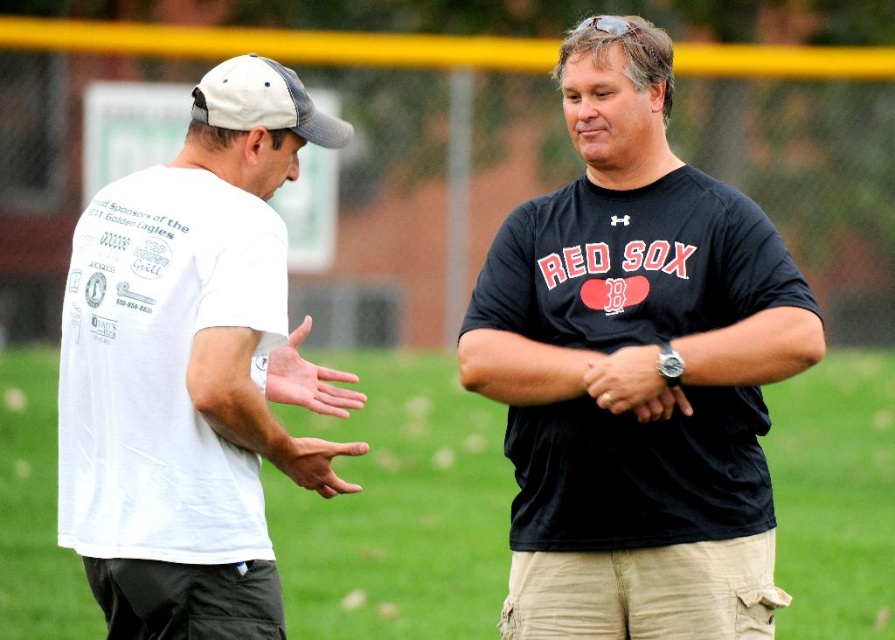
What do you see at coordinates (658, 365) in the screenshot? I see `black matte t-shirt at center` at bounding box center [658, 365].

Locate an element on the screen. Image resolution: width=895 pixels, height=640 pixels. black matte t-shirt at center is located at coordinates (658, 365).

Between white mesh baseball cap at upper left and matte white hand at center, which one is positioned lower?

Positioned lower is matte white hand at center.

Which is behind, point (284, 76) or point (305, 317)?

Positioned behind is point (305, 317).

Between point (297, 83) and point (312, 385), which one is positioned in front?

Point (297, 83) is more forward.

Locate an element on the screen. white mesh baseball cap at upper left is located at coordinates (263, 100).

How distant is white cotton t-shirt at left from white matte shirt at left?

white cotton t-shirt at left is 4.63 meters away from white matte shirt at left.

Looking at this image, can you confirm if white cotton t-shirt at left is positioned below white matte shirt at left?

No.

Where is `white cotton t-shirt at left`? white cotton t-shirt at left is located at coordinates (188, 365).

This screenshot has height=640, width=895. Find the location of `white cotton t-shirt at left`. white cotton t-shirt at left is located at coordinates (188, 365).